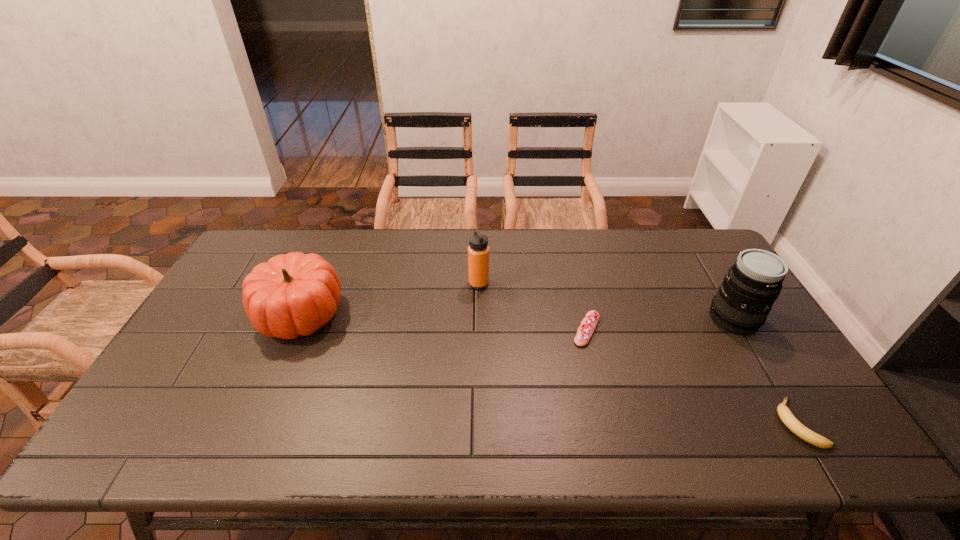
Where is `telephoto lens`? telephoto lens is located at coordinates (742, 303).

You are a GUI agent. You are given a task and a screenshot of the screen. Output one action in this format:
    pyautogui.click(x=<x>, y=<y>)
    Task: Click on the fourth object from right to left
    This screenshot has height=540, width=960.
    Given the screenshot: What is the action you would take?
    pyautogui.click(x=478, y=250)

Where is `pumpkin`? This screenshot has height=540, width=960. pumpkin is located at coordinates (293, 294).

Locate an element on the screen. the second shortest object is located at coordinates [x=584, y=333].

The height and width of the screenshot is (540, 960). I want to click on eclair, so click(x=584, y=333).

This screenshot has height=540, width=960. Identify the location of the nearest object. coord(791,422).

This screenshot has width=960, height=540. What are the coordinates of `the shortest object` in the screenshot? It's located at 791,422.

Identify the location of free spot located on the front of the telephoto lens. The width and height of the screenshot is (960, 540). (792, 416).

This screenshot has width=960, height=540. What are the coordinates of `blank space located on the front of the fourth object from right to left` in the screenshot? It's located at (478, 328).

You are a GUI agent. You are given a task and a screenshot of the screen. Output one action in this format:
    pyautogui.click(x=<x>, y=<y>)
    Task: Click on the free space located 0.100m on the left of the pumpkin
    The width and height of the screenshot is (960, 540).
    Given the screenshot: What is the action you would take?
    point(221,313)